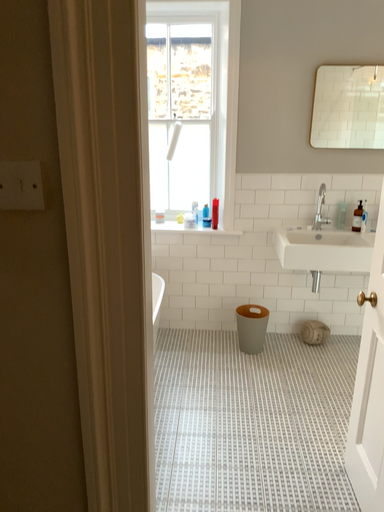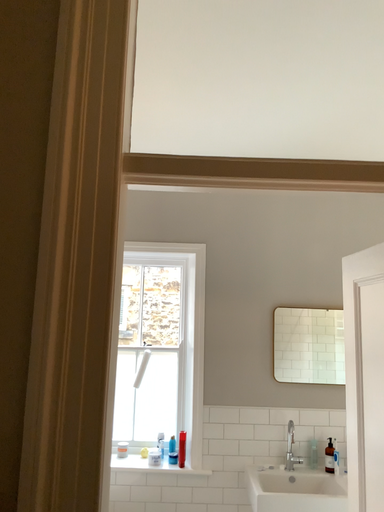
Question: Which way did the camera rotate in the video?

Choices:
 (A) rotated downward
 (B) rotated upward

Answer: (B)